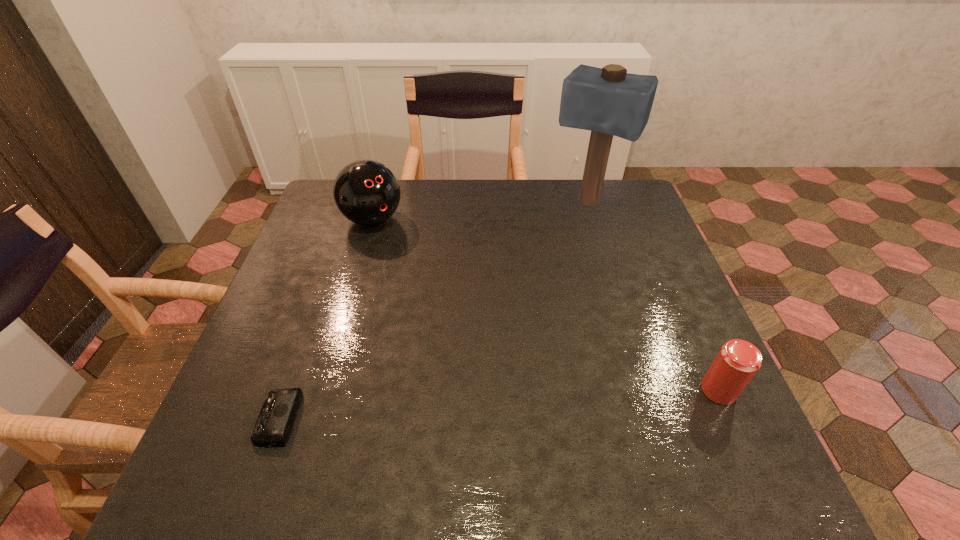
Identify the location of unoccupied position between the third tallest object and the shortest object. (498, 404).

Locate an element on the screen. This screenshot has width=960, height=540. blank region between the beer can and the shortest object is located at coordinates (498, 404).

Identify the location of free space between the second tallest object and the tallest object. (480, 211).

Locate an element on the screen. This screenshot has height=540, width=960. empty space between the tallest object and the bowling ball is located at coordinates coord(480,211).

In order to click on free space between the bowling ball and the alarm clock in this screenshot , I will do `click(325, 319)`.

Image resolution: width=960 pixels, height=540 pixels. I want to click on vacant area between the mallet and the bowling ball, so click(x=480, y=211).

At what (x,y) coordinates should I click in order to perform the action: click on vacant space that's between the tallest object and the shortest object. Please return your answer as a coordinate pair (x, y). The height and width of the screenshot is (540, 960). Looking at the image, I should click on (433, 310).

I want to click on vacant area between the shortest object and the mallet, so click(x=433, y=310).

The image size is (960, 540). I want to click on free space that is in between the tallest object and the third tallest object, so click(653, 296).

In order to click on the second closest object relative to the bowling ball in this screenshot , I will do `click(275, 421)`.